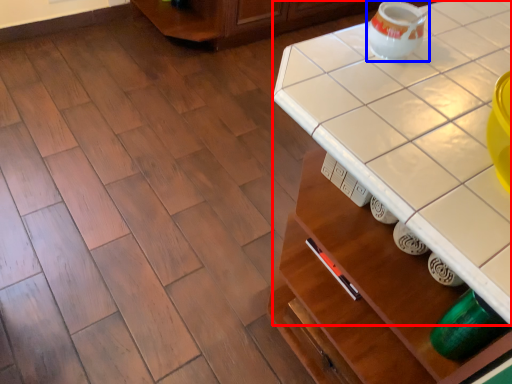
Question: Which point is further to the camera, counter top (highlighted by a red box) or tea pot (highlighted by a blue box)?

Choices:
 (A) counter top
 (B) tea pot

Answer: (B)